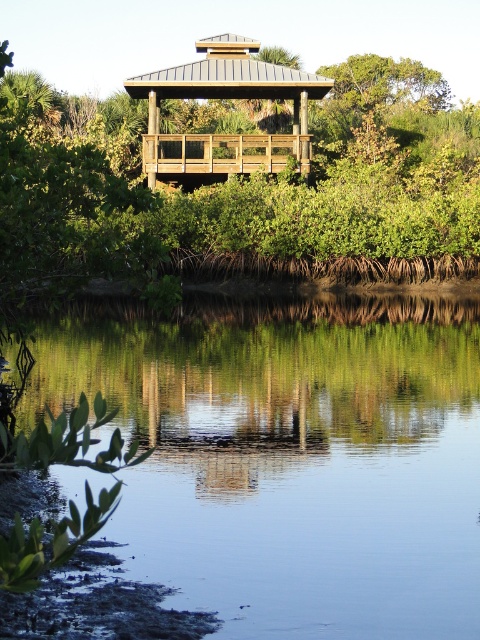
Question: Can you confirm if clear water at lower center is wider than wooden gazebo at center?

Choices:
 (A) yes
 (B) no

Answer: (A)

Question: Which object appears farthest from the camera in this image?

Choices:
 (A) clear water at lower center
 (B) green wood gazebo at upper center

Answer: (A)

Question: Is the position of clear water at lower center less distant than that of wooden gazebo at center?

Choices:
 (A) no
 (B) yes

Answer: (B)

Question: Which object is farther from the camera taking this photo?

Choices:
 (A) green wood gazebo at upper center
 (B) clear water at lower center

Answer: (B)

Question: Among these objects, which one is farthest from the camera?

Choices:
 (A) green wood gazebo at upper center
 (B) wooden gazebo at center
 (C) clear water at lower center

Answer: (B)

Question: Is clear water at lower center behind green wood gazebo at upper center?

Choices:
 (A) yes
 (B) no

Answer: (A)